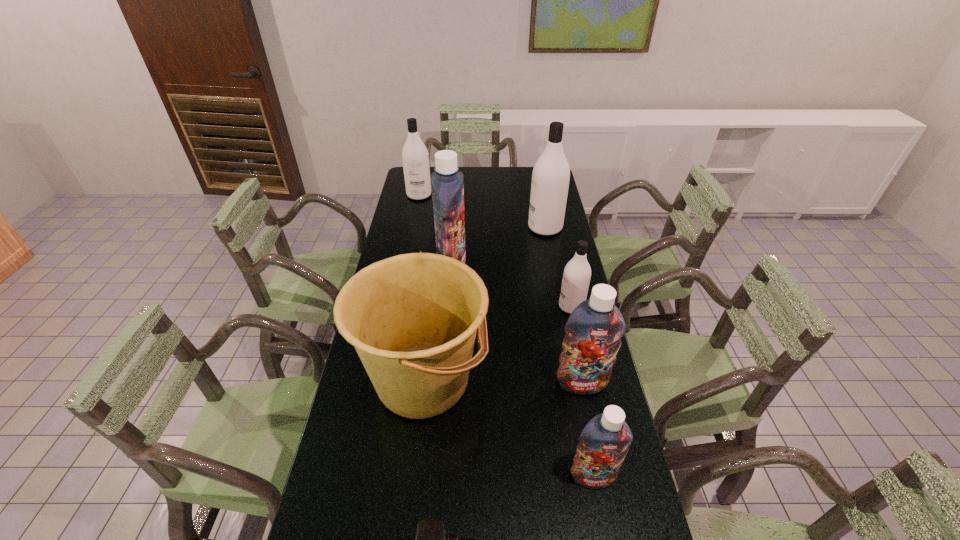
Identify the location of the second farthest white shampoo. (551, 173).

The width and height of the screenshot is (960, 540). Find the location of `the second farthest object`. the second farthest object is located at coordinates (551, 173).

Find the location of a particular element. The height and width of the screenshot is (540, 960). the sixth nearest object is located at coordinates (447, 182).

This screenshot has width=960, height=540. Identify the location of the biggest blue shampoo. (447, 182).

I want to click on the leftmost white shampoo, so click(415, 158).

I want to click on the farthest shampoo, so click(x=415, y=158).

The width and height of the screenshot is (960, 540). In order to click on the second biggest blue shampoo in this screenshot , I will do `click(594, 329)`.

Identify the location of the second farthest blue shampoo. (594, 329).

Where is `bucket`? The image size is (960, 540). bucket is located at coordinates (412, 318).

Locate an element on the screen. This screenshot has height=540, width=960. the third nearest shampoo is located at coordinates (576, 278).